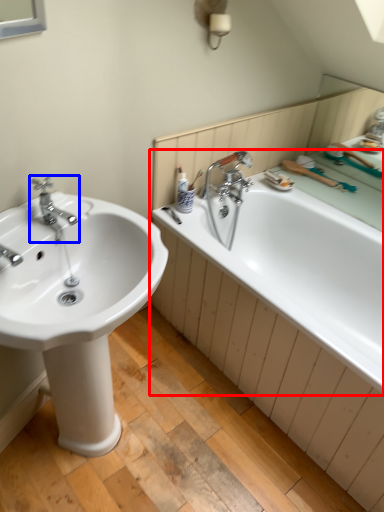
Question: Which object is further to the camera taking this photo, bathtub (highlighted by a red box) or tap (highlighted by a blue box)?

Choices:
 (A) bathtub
 (B) tap

Answer: (B)